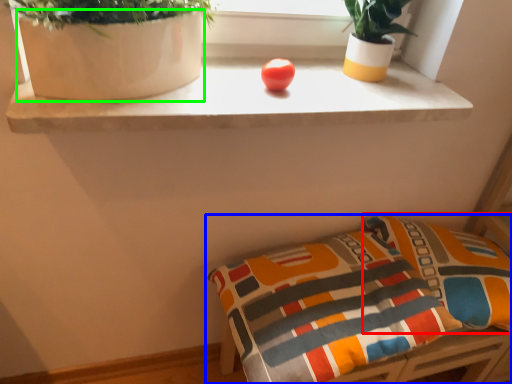
Question: Which object is positioned farthest from pillow (highlighted by a red box)? Select from furniture (highlighted by a blue box) and vase (highlighted by a green box).

Choices:
 (A) furniture
 (B) vase

Answer: (B)